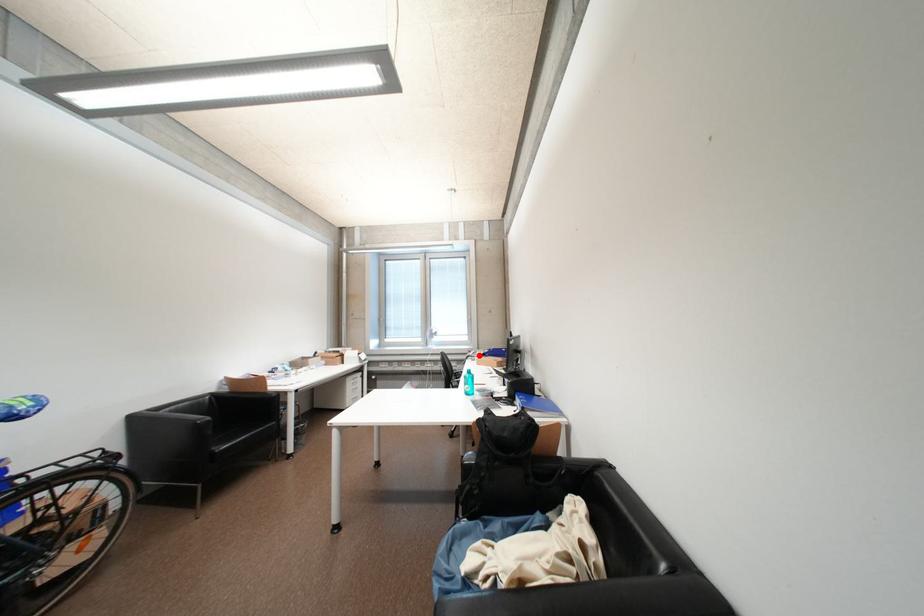
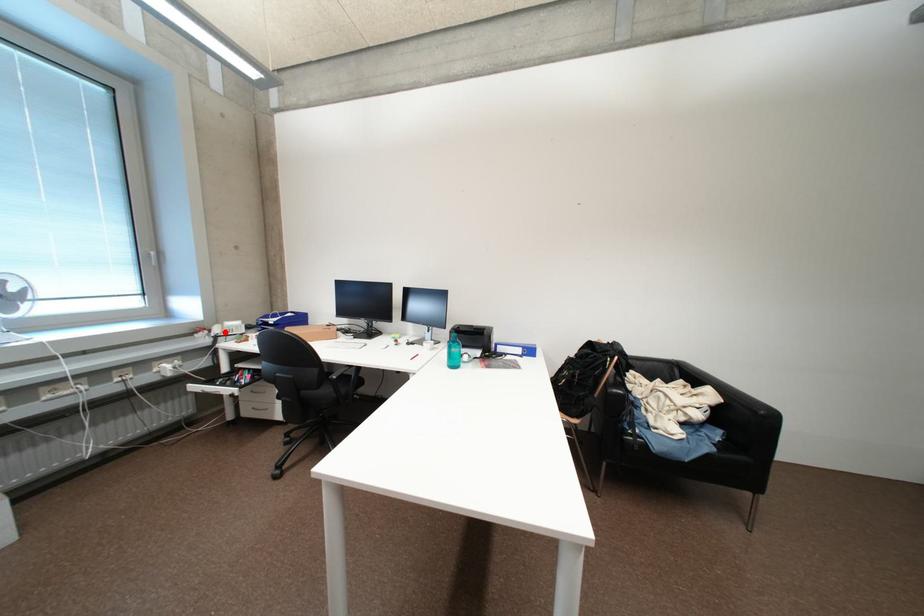
Consider the image. I am providing you with two images of the same scene from different viewpoints. A red point is marked on the first image and another point is marked on the second image. Is the marked point in image1 the same physical position as the marked point in image2?

Yes